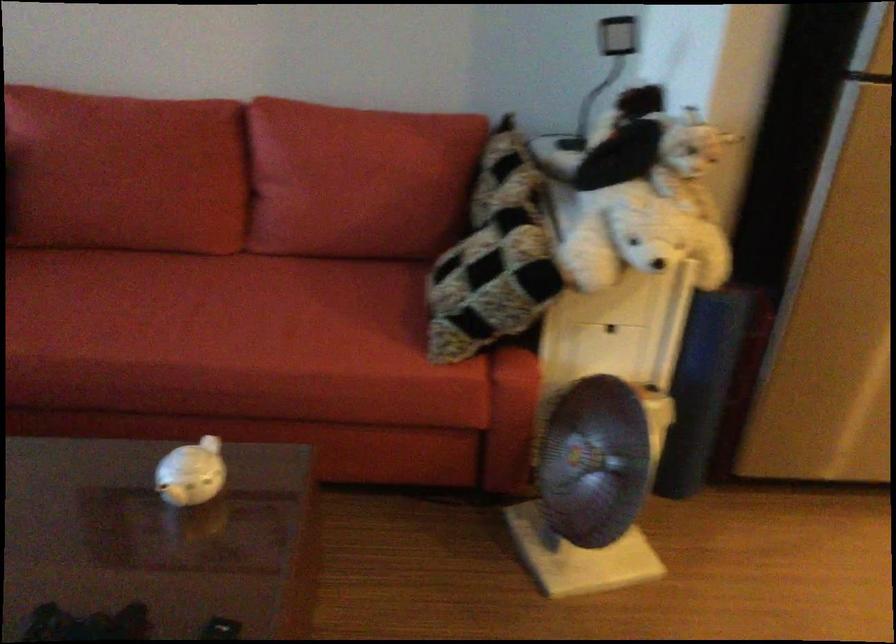
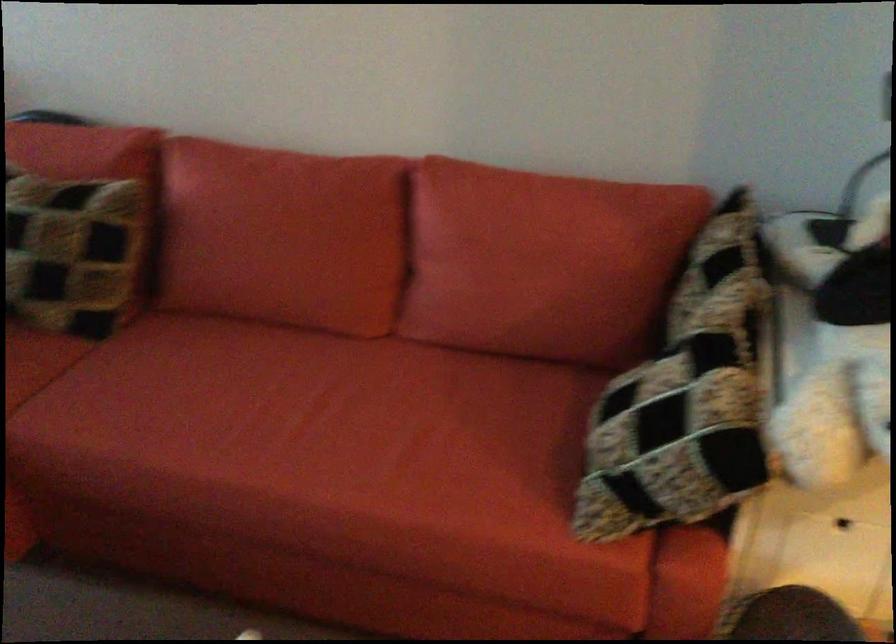
Where in the second image is the point corresponding to point (138, 167) from the first image?

(282, 236)